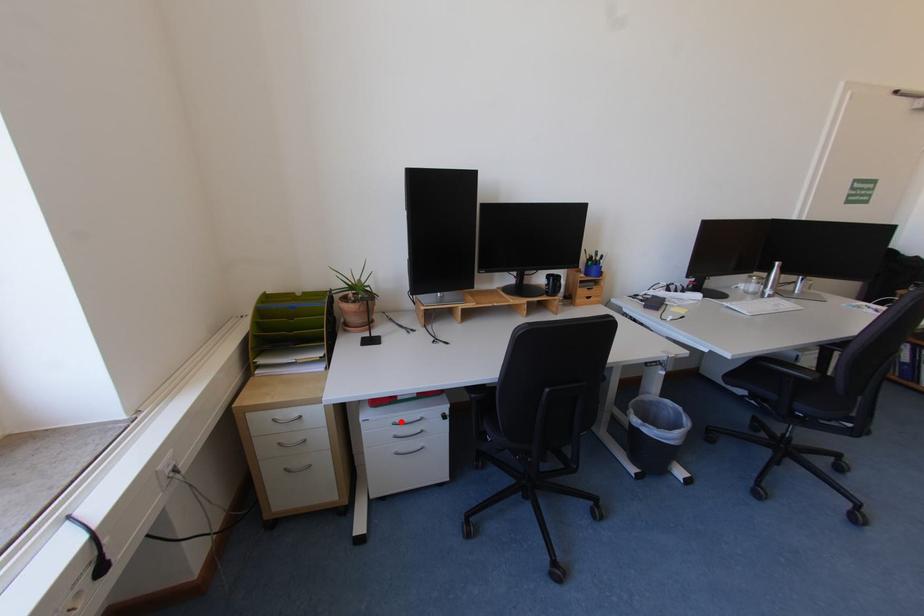
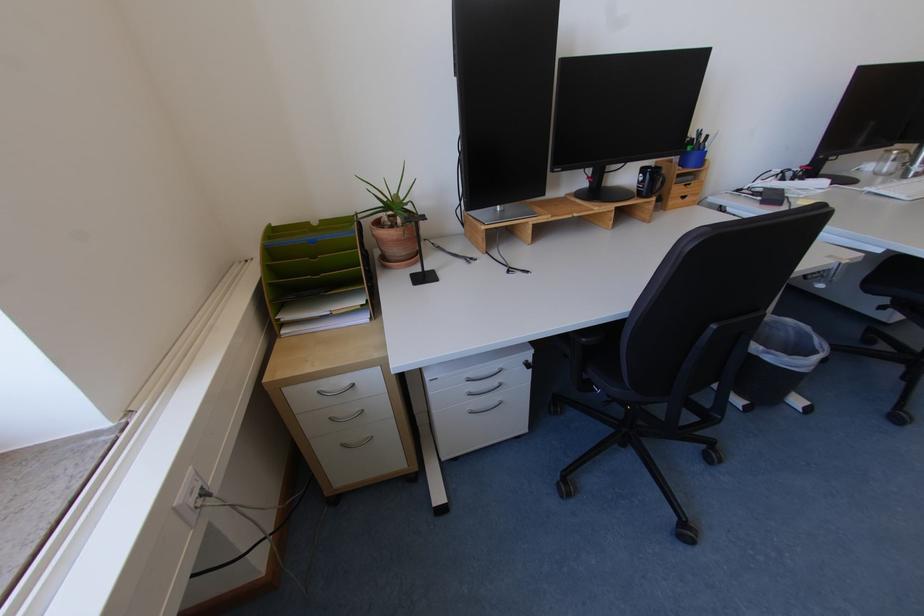
Question: I am providing you with two images of the same scene from different viewpoints. A red point is shown in image1. For the corresponding object point in image2, is it positioned nearer or farther from the camera?

Choices:
 (A) Nearer
 (B) Farther

Answer: (A)